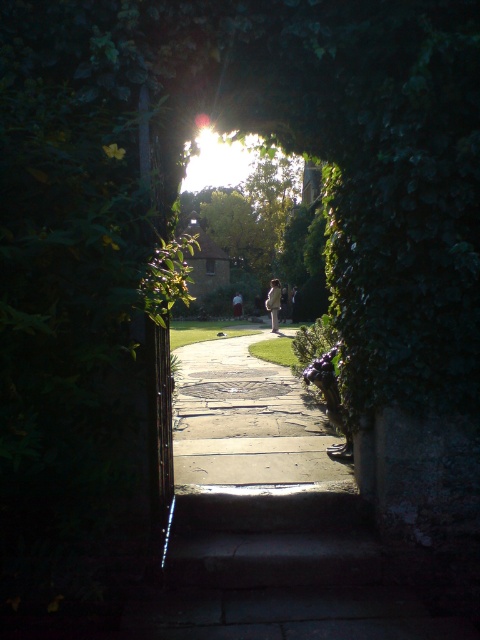
Does point (271, 381) lie behind point (271, 308)?

No, (271, 381) is closer to viewer.

Does point (292, 419) lie in front of point (275, 317)?

Yes, point (292, 419) is in front of point (275, 317).

Identify the location of smooth concrete path at center. (247, 420).